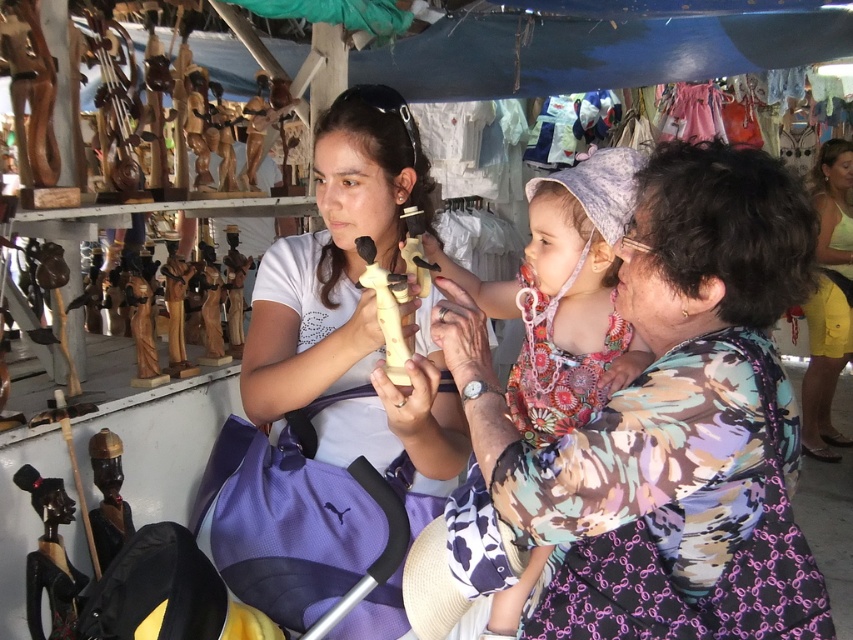
You are a customer at the market stall and want to buy a gift for your friend. You see the floral print dress at center and the matte white statue at center. Which one is taller?

The matte white statue at center is taller than the floral print dress at center.

From the picture: You are a delivery robot with a package that needs to be placed between the yellow cotton shorts at lower right and the wooden figurine at lower left. The package requires 12 feet of space. Is there enough space between them?

The yellow cotton shorts at lower right and wooden figurine at lower left are 13.06 feet apart, so yes, there is enough space to place the package between them since 13.06 feet is greater than the required 12 feet.

You are standing at the market stall and want to place a small wooden figurine between the two points labeled point (x=608, y=611) and point (x=393, y=205). Given that the figurine is 0.1 units wide, will it fit between them?

The distance between point (x=608, y=611) and point (x=393, y=205) is 0.66 units. Since the figurine is only 0.1 units wide, it will easily fit between them.